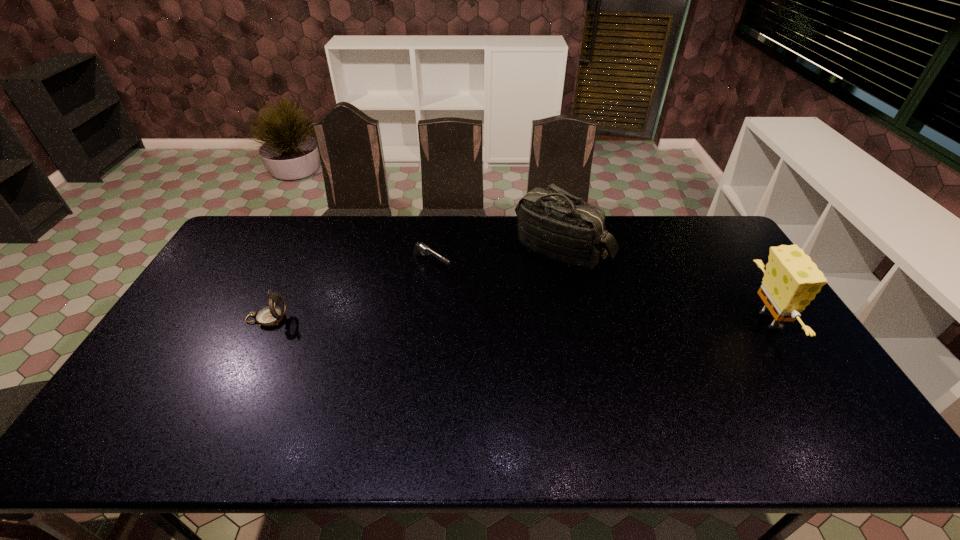
Where is `vacant space on the desktop that is between the leftmost object and the sponge and is positioned on the front-facing side of the shortest object`? This screenshot has width=960, height=540. vacant space on the desktop that is between the leftmost object and the sponge and is positioned on the front-facing side of the shortest object is located at coordinates (513, 320).

Identify the location of vacant spot on the desktop that is between the compass and the rightmost object and is positioned at the front padded panel of the shoulder bag. (535, 320).